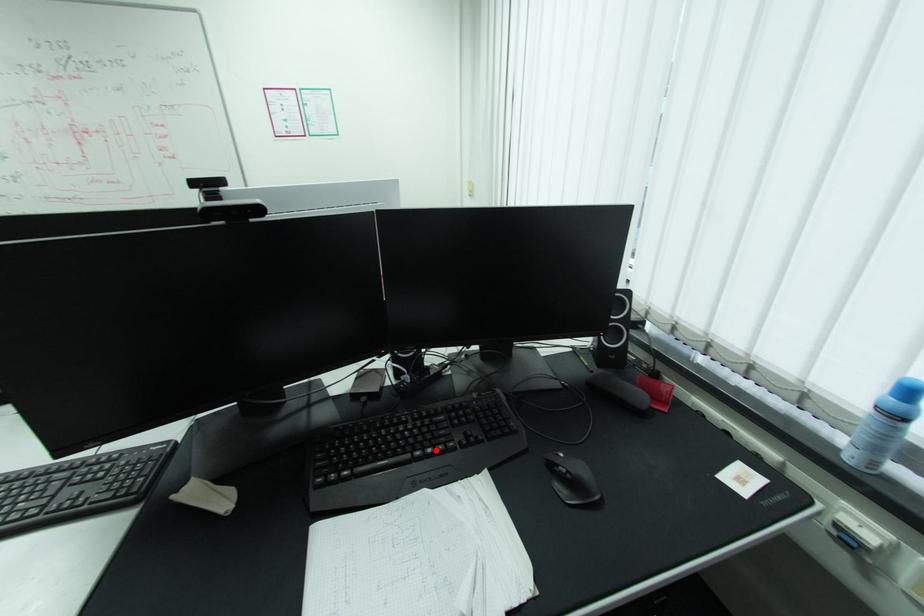
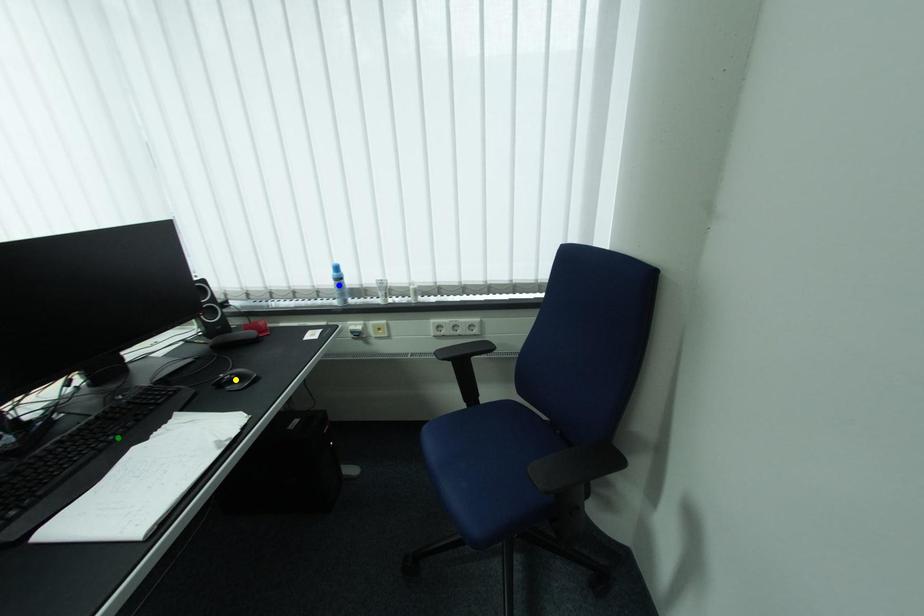
Question: I am providing you with two images of the same scene from different viewpoints. A red point is marked on the first image. You are given multiple points on the second image. Which spot in image 2 lines up with the point in image 1?

Choices:
 (A) blue point
 (B) green point
 (C) yellow point

Answer: (B)